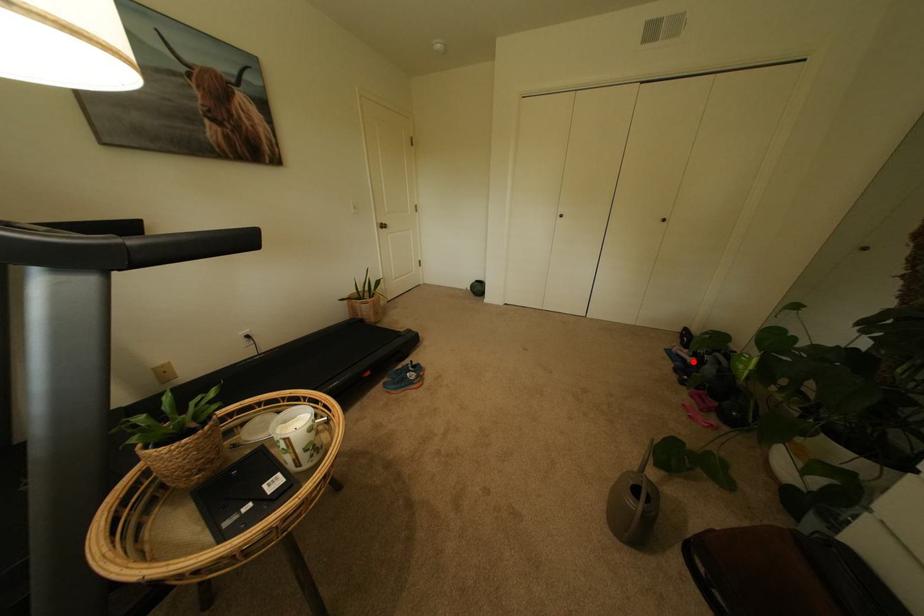
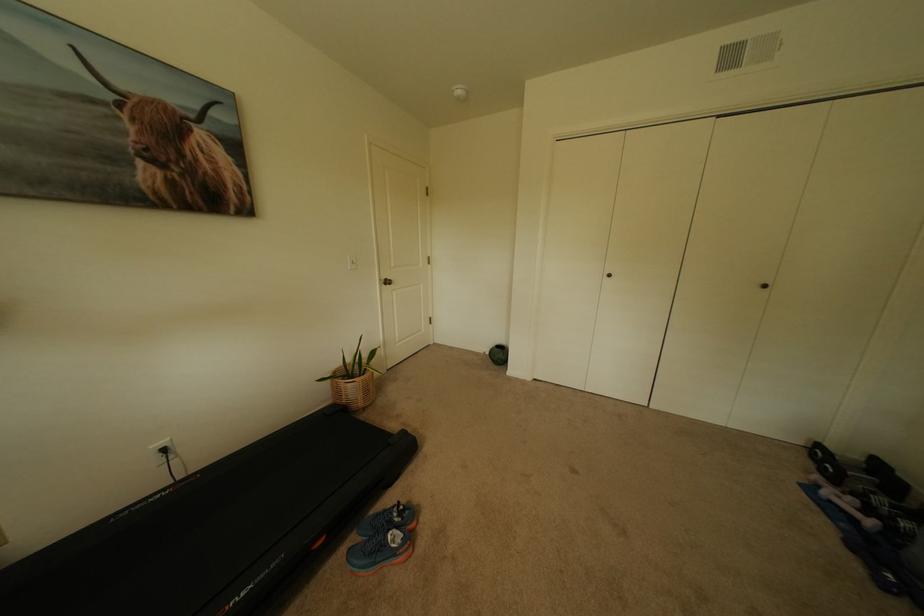
Question: I am providing you with two images of the same scene from different viewpoints. In image1, a red point is highlighted. Considering the same 3D point in image2, which of the following is correct?

Choices:
 (A) It is closer
 (B) It is farther

Answer: (A)